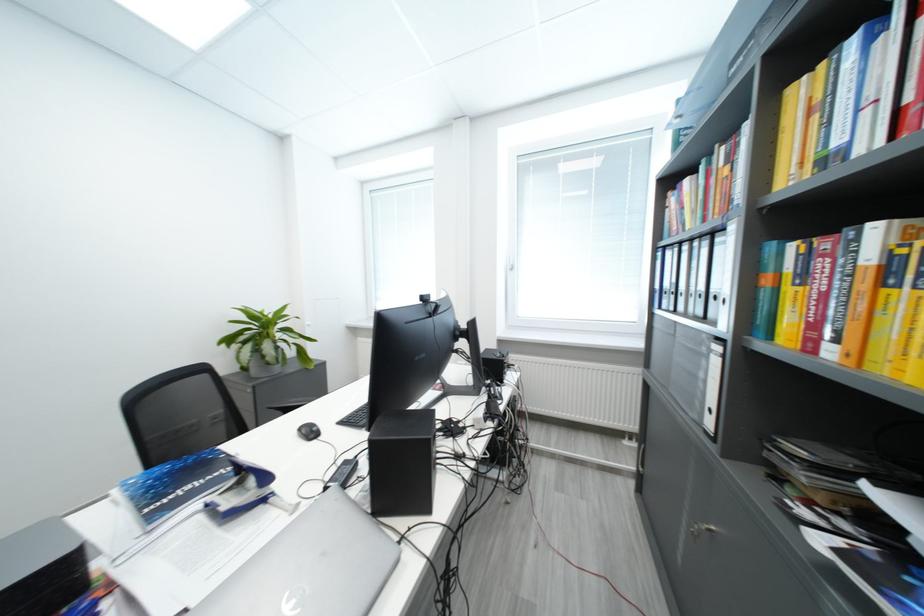
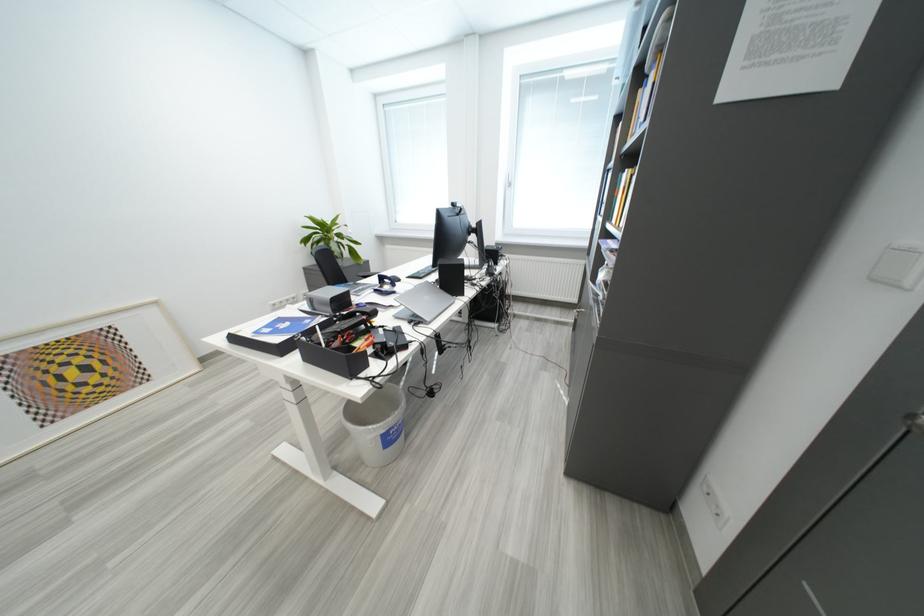
Locate, in the second image, the point that corresponds to point (274, 503) in the first image.

(403, 294)